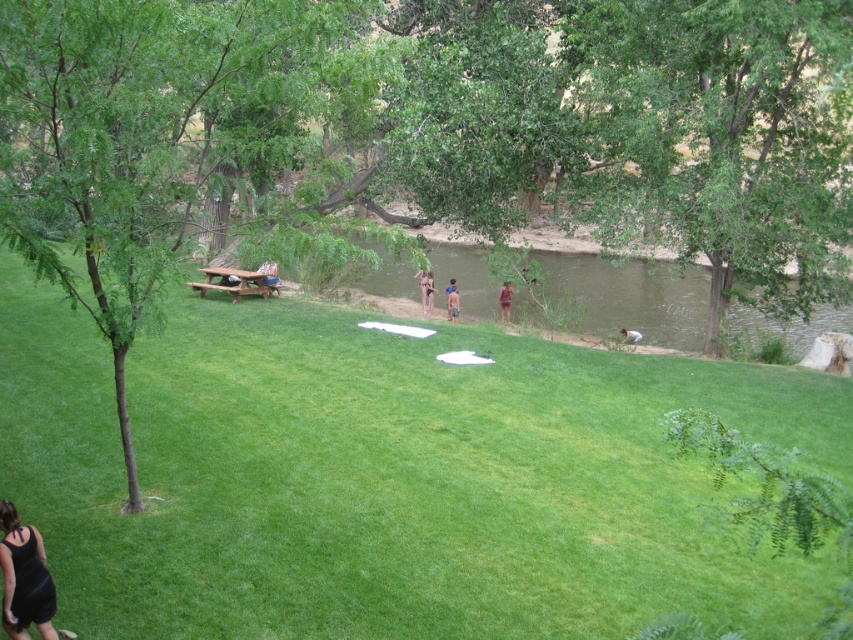
Question: Does green leafy tree at center appear on the right side of brown textured swimsuit at center?

Choices:
 (A) yes
 (B) no

Answer: (B)

Question: Does green leafy tree at center appear on the right side of purple fabric dress at center?

Choices:
 (A) no
 (B) yes

Answer: (A)

Question: Does black matte dress at lower left appear under light brown wooden stick at lower center?

Choices:
 (A) no
 (B) yes

Answer: (B)

Question: Which object is the closest to the tan skin person at center?

Choices:
 (A) green grassy area at center
 (B) purple fabric dress at center
 (C) light brown wooden stick at lower center

Answer: (B)

Question: Considering the real-world distances, which object is closest to the green leafy tree at center?

Choices:
 (A) light brown wooden stick at lower center
 (B) brown textured swimsuit at center
 (C) black matte dress at lower left
 (D) purple fabric dress at center

Answer: (C)

Question: Which object is positioned closest to the light brown wooden stick at lower center?

Choices:
 (A) green grassy area at center
 (B) brown wooden picnic table at center
 (C) purple fabric dress at center

Answer: (C)